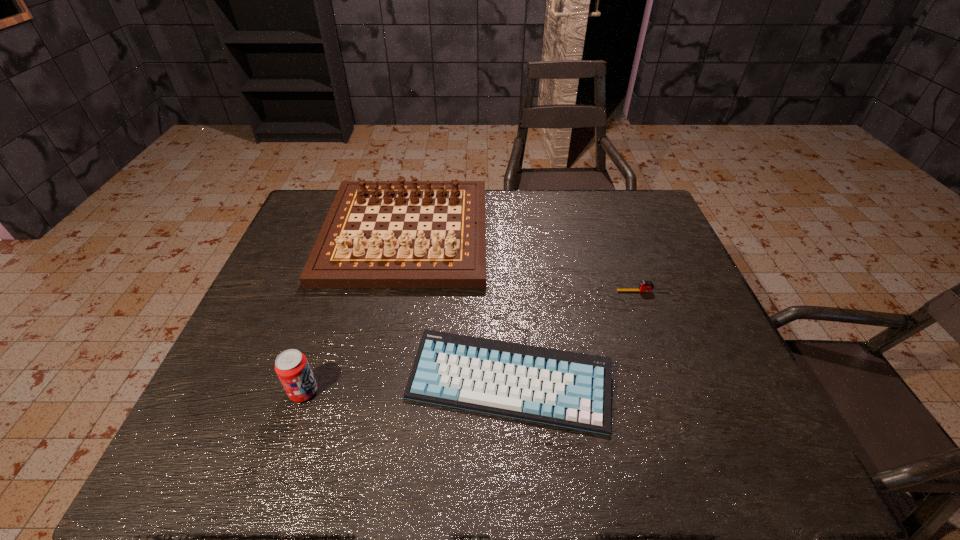
Where is `gameboard`? gameboard is located at coordinates (447, 253).

Find the location of a particular element. soda can is located at coordinates [291, 366].

The height and width of the screenshot is (540, 960). What are the coordinates of `the third tallest object` in the screenshot? It's located at pos(569,389).

Locate an element on the screen. The height and width of the screenshot is (540, 960). the rightmost object is located at coordinates click(x=645, y=286).

Where is `the shortest object`? The height and width of the screenshot is (540, 960). the shortest object is located at coordinates (645, 286).

Locate an element on the screen. The width and height of the screenshot is (960, 540). blank space located 0.210m on the side with the white pieces of the gameboard is located at coordinates (382, 352).

Locate an element on the screen. The height and width of the screenshot is (540, 960). free space located 0.060m on the surface of the soda can is located at coordinates (346, 392).

This screenshot has height=540, width=960. I want to click on free point located 0.200m on the left of the second shortest object, so click(x=316, y=383).

Where is `vacant area situated 0.340m on the left of the shortest object`? Image resolution: width=960 pixels, height=540 pixels. vacant area situated 0.340m on the left of the shortest object is located at coordinates (491, 292).

The width and height of the screenshot is (960, 540). I want to click on object at the far edge, so click(x=447, y=253).